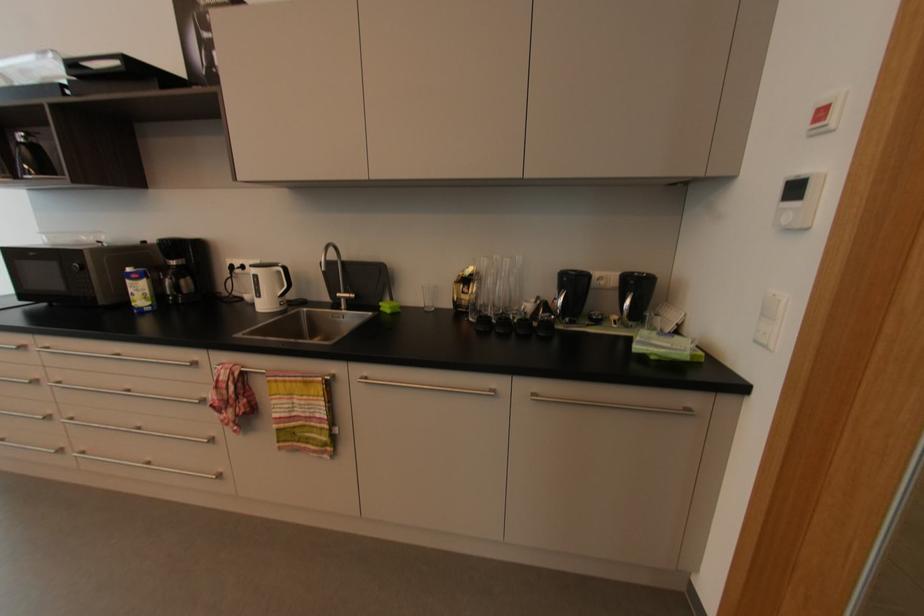
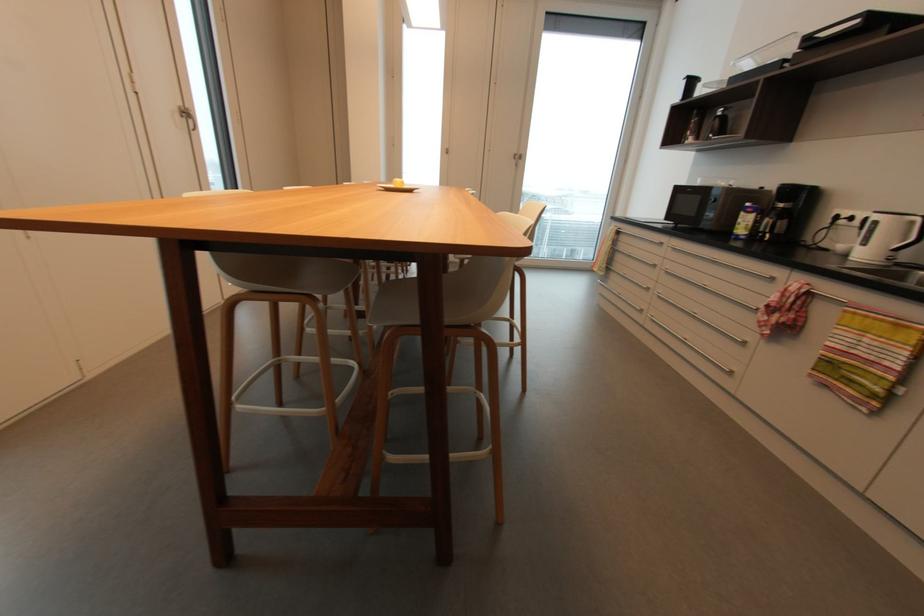
Based on the continuous images, in which direction is the camera rotating?

The camera rotated toward left-down.